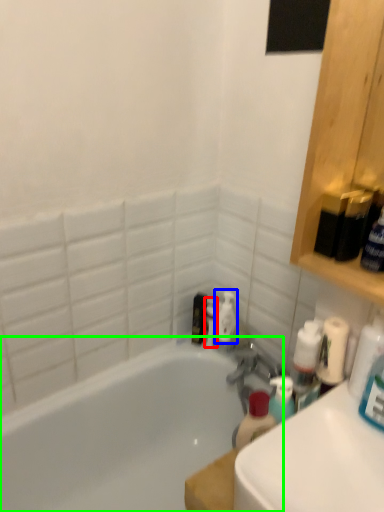
Question: Which object is the closest to the toiletry (highlighted by a red box)? Choose among these: cleaning product (highlighted by a blue box) or bathtub (highlighted by a green box).

Choices:
 (A) cleaning product
 (B) bathtub

Answer: (A)